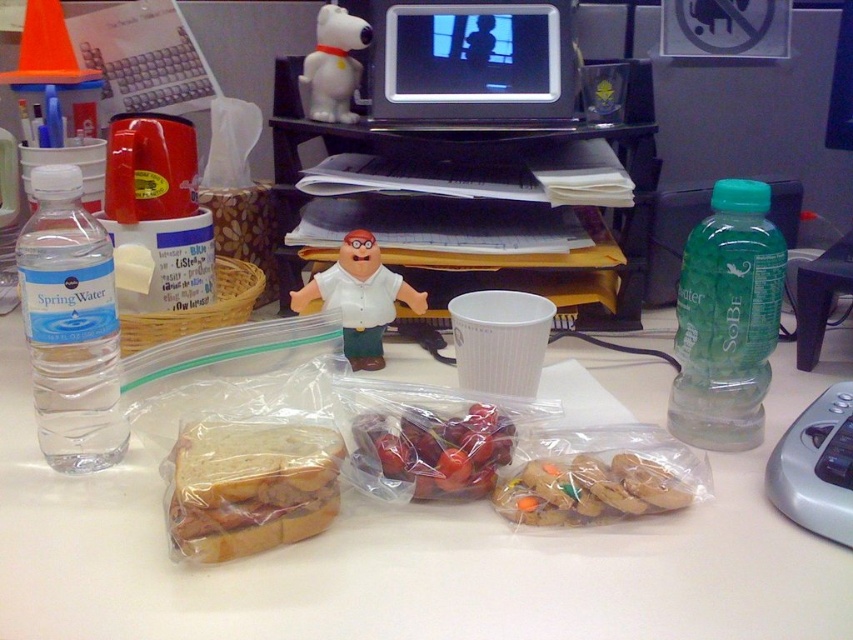
Can you confirm if green translucent bottle at right is shorter than white plastic snoopy at upper center?

Incorrect, green translucent bottle at right's height does not fall short of white plastic snoopy at upper center's.

Is point (769, 250) closer to viewer compared to point (323, 81)?

Yes, it is in front of point (323, 81).

Who is more distant from viewer, (743, 380) or (335, 81)?

The point (335, 81) is more distant.

Where is `green translucent bottle at right`? green translucent bottle at right is located at coordinates (727, 320).

Is point (721, 611) behind point (310, 54)?

That is False.

Is clear plastic bag at center taller than white plastic snoopy at upper center?

Yes.

This screenshot has height=640, width=853. Find the location of `clear plastic bag at center`. clear plastic bag at center is located at coordinates (415, 556).

Where is `clear plastic bag at center`? This screenshot has height=640, width=853. clear plastic bag at center is located at coordinates (415, 556).

Is translucent plastic cookies at center behind white matte figurine at center?

No, it is in front of white matte figurine at center.

Who is lower down, translucent plastic cookies at center or white matte figurine at center?

Positioned lower is translucent plastic cookies at center.

Is point (514, 476) behind point (383, 358)?

That is False.

At what (x,y) coordinates should I click in order to perform the action: click on translucent plastic cookies at center. Please return your answer as a coordinate pair (x, y). The height and width of the screenshot is (640, 853). Looking at the image, I should click on (589, 490).